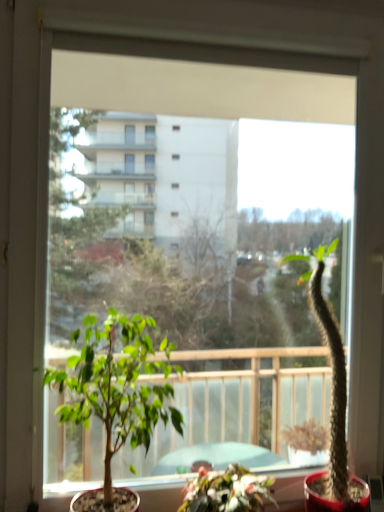
Question: From a real-world perspective, relative to green succulent at right, the first houseplant when ordered from right to left, is green matte plant at center, the second houseplant in the right-to-left sequence, vertically above or below?

Choices:
 (A) below
 (B) above

Answer: (A)

Question: Would you say green matte plant at center, which appears as the second houseplant when viewed from the left, is to the left or to the right of green succulent at right, the first houseplant when ordered from right to left, in the picture?

Choices:
 (A) left
 (B) right

Answer: (A)

Question: Which of these objects is positioned farthest from the green leafy plant at center, positioned as the 1th houseplant in left-to-right order?

Choices:
 (A) green matte plant at center, which appears as the second houseplant when viewed from the left
 (B) green succulent at right, the 3th houseplant positioned from the left

Answer: (B)

Question: Based on their relative distances, which object is nearer to the green leafy plant at center, positioned as the 1th houseplant in left-to-right order?

Choices:
 (A) green succulent at right, the 3th houseplant positioned from the left
 (B) green matte plant at center, which appears as the second houseplant when viewed from the left

Answer: (B)